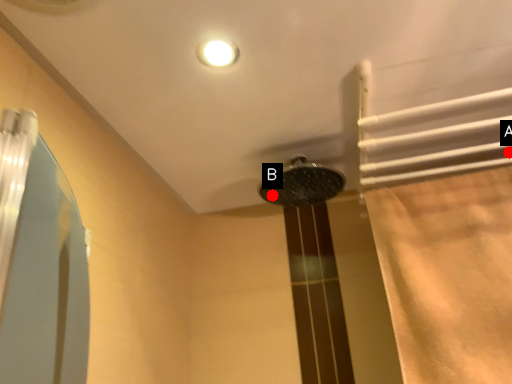
Question: Two points are circled on the image, labeled by A and B beside each circle. Which point is closer to the camera?

Choices:
 (A) A is closer
 (B) B is closer

Answer: (A)